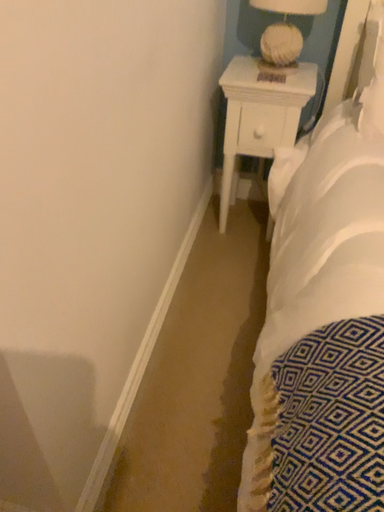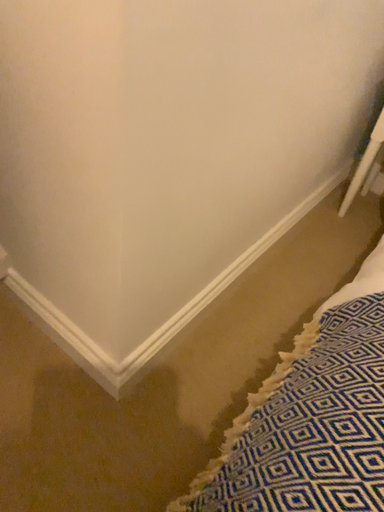
Question: Which way did the camera rotate in the video?

Choices:
 (A) rotated left
 (B) rotated right

Answer: (A)